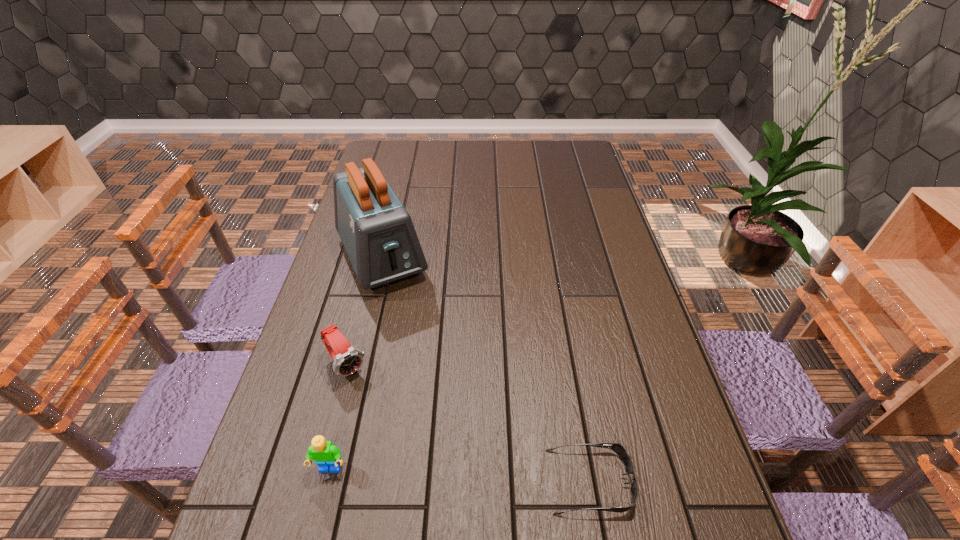
At what (x,y) coordinates should I click in order to perform the action: click on object located in the near left corner section of the desktop. Please return your answer as a coordinate pair (x, y). Image resolution: width=960 pixels, height=540 pixels. Looking at the image, I should click on (327, 456).

Identify the location of object present at the near right corner. (616, 447).

Where is `free space at the far edge of the desktop`? This screenshot has height=540, width=960. free space at the far edge of the desktop is located at coordinates [x=489, y=152].

Find the location of a particular element. vacant region at the near edge of the desktop is located at coordinates (401, 486).

This screenshot has width=960, height=540. In order to click on vacant space at the left edge in this screenshot , I will do `click(324, 350)`.

Identify the location of vacant point at the right edge. The height and width of the screenshot is (540, 960). (634, 339).

Where is `vacant space at the far right corner of the desktop`? The height and width of the screenshot is (540, 960). vacant space at the far right corner of the desktop is located at coordinates (564, 158).

Find the location of a particular element. This screenshot has width=960, height=540. free space between the shortest object and the tallest object is located at coordinates (486, 369).

This screenshot has height=540, width=960. What are the coordinates of `blank region between the rightmost object and the Lego` in the screenshot? It's located at (460, 475).

Locate an element on the screen. The height and width of the screenshot is (540, 960). free space between the third nearest object and the shortest object is located at coordinates (468, 423).